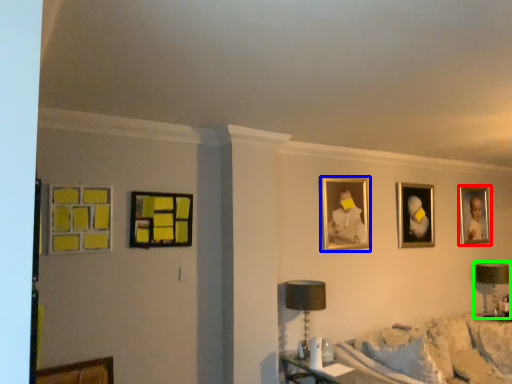
Question: Estimate the real-world distances between objects in this image. Which object is closer to picture frame (highlighted by a red box), picture frame (highlighted by a blue box) or table lamp (highlighted by a green box)?

Choices:
 (A) picture frame
 (B) table lamp

Answer: (B)